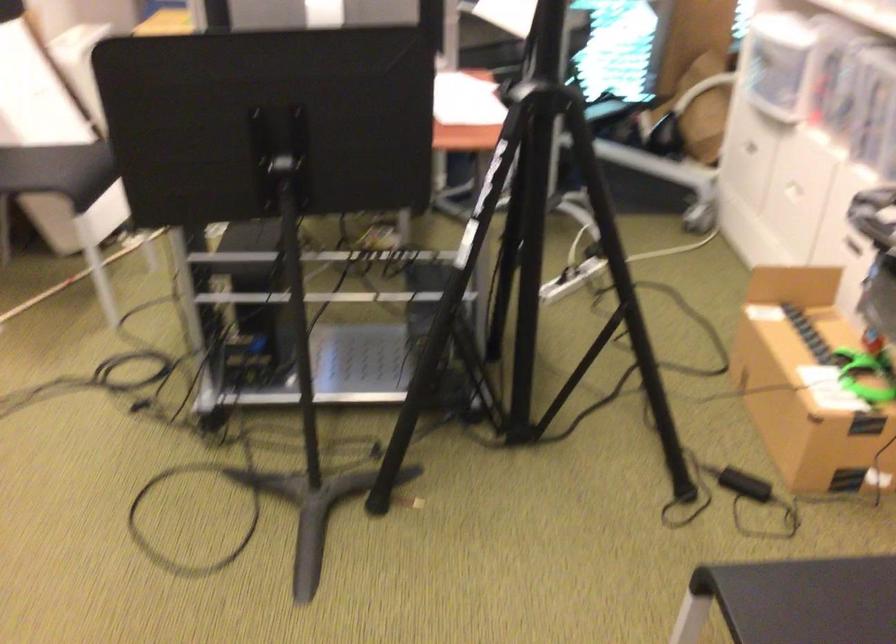
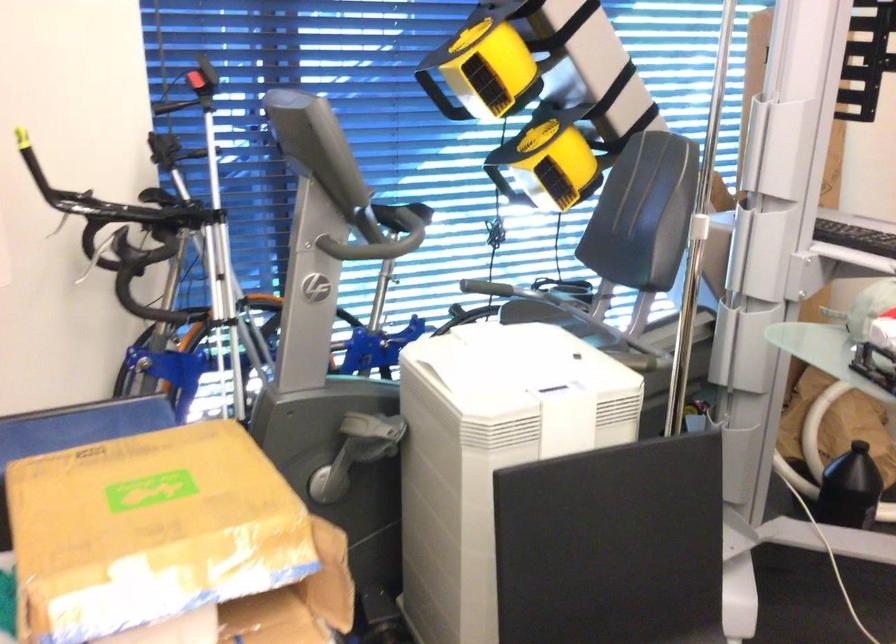
Which direction would the cameraman need to move to produce the second image?

The cameraman moved toward left, forward.